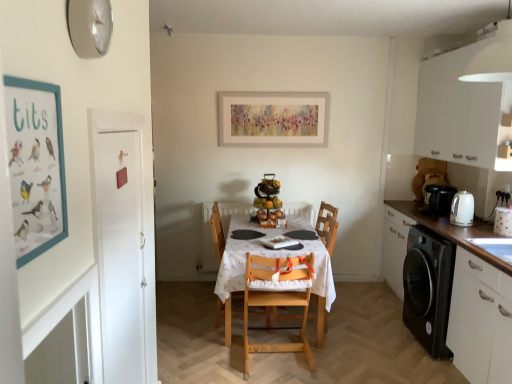
At what (x,y) coordinates should I click in order to perform the action: click on vacant space to the left of natural wood highchair at center, arranged as the first chair when viewed from the front. Please return your answer as a coordinate pair (x, y). Image resolution: width=512 pixels, height=384 pixels. Looking at the image, I should click on (214, 355).